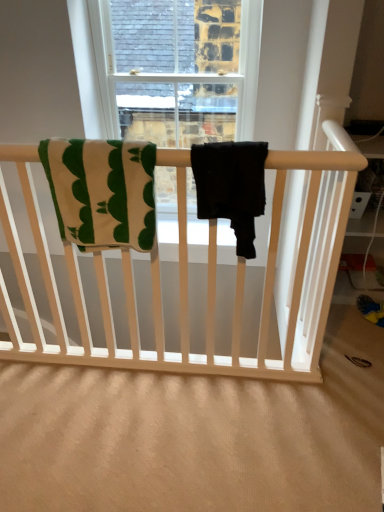
What do you see at coordinates (231, 186) in the screenshot? The width and height of the screenshot is (384, 512). I see `black matte pants at center, the first beach towel from the right` at bounding box center [231, 186].

Where is `black matte pants at center, which is the second beach towel from left to right`? This screenshot has height=512, width=384. black matte pants at center, which is the second beach towel from left to right is located at coordinates (231, 186).

Describe the element at coordinates (102, 191) in the screenshot. I see `green striped towel at upper left, which appears as the 1th beach towel when viewed from the left` at that location.

What is the approximate width of green striped towel at upper left, which appears as the 1th beach towel when viewed from the left?

It is 9.20 inches.

The height and width of the screenshot is (512, 384). I want to click on green striped towel at upper left, which appears as the 1th beach towel when viewed from the left, so click(102, 191).

The height and width of the screenshot is (512, 384). What are the coordinates of `black matte pants at center, the first beach towel from the right` in the screenshot? It's located at (231, 186).

From the picture: Which is more to the right, green striped towel at upper left, which appears as the 1th beach towel when viewed from the left, or black matte pants at center, the first beach towel from the right?

Positioned to the right is black matte pants at center, the first beach towel from the right.

Based on the photo, considering the positions of objects green striped towel at upper left, the second beach towel positioned from the right, and black matte pants at center, which is the second beach towel from left to right, in the image provided, who is behind, green striped towel at upper left, the second beach towel positioned from the right, or black matte pants at center, which is the second beach towel from left to right,?

green striped towel at upper left, the second beach towel positioned from the right, is further from the camera.

Which is in front, point (90, 234) or point (252, 245)?

The point (90, 234) is closer.

From the image's perspective, which is above, green striped towel at upper left, which appears as the 1th beach towel when viewed from the left, or black matte pants at center, which is the second beach towel from left to right?

green striped towel at upper left, which appears as the 1th beach towel when viewed from the left.

From a real-world perspective, is green striped towel at upper left, which appears as the 1th beach towel when viewed from the left, located beneath black matte pants at center, which is the second beach towel from left to right?

Indeed, from a real-world perspective, green striped towel at upper left, which appears as the 1th beach towel when viewed from the left, is positioned beneath black matte pants at center, which is the second beach towel from left to right.

Is green striped towel at upper left, the second beach towel positioned from the right, wider or thinner than black matte pants at center, which is the second beach towel from left to right?

green striped towel at upper left, the second beach towel positioned from the right, is thinner than black matte pants at center, which is the second beach towel from left to right.

Considering the relative sizes of green striped towel at upper left, which appears as the 1th beach towel when viewed from the left, and black matte pants at center, the first beach towel from the right, in the image provided, is green striped towel at upper left, which appears as the 1th beach towel when viewed from the left, shorter than black matte pants at center, the first beach towel from the right,?

In fact, green striped towel at upper left, which appears as the 1th beach towel when viewed from the left, may be taller than black matte pants at center, the first beach towel from the right.

Considering the sizes of green striped towel at upper left, the second beach towel positioned from the right, and black matte pants at center, which is the second beach towel from left to right, in the image, is green striped towel at upper left, the second beach towel positioned from the right, bigger or smaller than black matte pants at center, which is the second beach towel from left to right,?

Considering their sizes, green striped towel at upper left, the second beach towel positioned from the right, takes up more space than black matte pants at center, which is the second beach towel from left to right.

Is green striped towel at upper left, which appears as the 1th beach towel when viewed from the left, located outside black matte pants at center, the first beach towel from the right?

green striped towel at upper left, which appears as the 1th beach towel when viewed from the left, lies outside black matte pants at center, the first beach towel from the right,'s area.

Is green striped towel at upper left, the second beach towel positioned from the right, far away from black matte pants at center, which is the second beach towel from left to right?

No.

Could you tell me if green striped towel at upper left, which appears as the 1th beach towel when viewed from the left, is facing black matte pants at center, which is the second beach towel from left to right?

No, green striped towel at upper left, which appears as the 1th beach towel when viewed from the left, is not facing towards black matte pants at center, which is the second beach towel from left to right.

Locate an element on the screen. Image resolution: width=384 pixels, height=512 pixels. beach towel to the left of black matte pants at center, which is the second beach towel from left to right is located at coordinates (102, 191).

Between black matte pants at center, the first beach towel from the right, and green striped towel at upper left, which appears as the 1th beach towel when viewed from the left, which one appears on the left side from the viewer's perspective?

green striped towel at upper left, which appears as the 1th beach towel when viewed from the left.

Is black matte pants at center, the first beach towel from the right, in front of or behind green striped towel at upper left, the second beach towel positioned from the right, in the image?

In the image, black matte pants at center, the first beach towel from the right, appears in front of green striped towel at upper left, the second beach towel positioned from the right.

Which is in front, point (265, 158) or point (76, 233)?

The point (265, 158) is in front.

From the image's perspective, does black matte pants at center, the first beach towel from the right, appear lower than green striped towel at upper left, which appears as the 1th beach towel when viewed from the left?

Correct, black matte pants at center, the first beach towel from the right, appears lower than green striped towel at upper left, which appears as the 1th beach towel when viewed from the left, in the image.

From a real-world perspective, is black matte pants at center, the first beach towel from the right, physically located above or below green striped towel at upper left, which appears as the 1th beach towel when viewed from the left?

From a real-world perspective, black matte pants at center, the first beach towel from the right, is physically above green striped towel at upper left, which appears as the 1th beach towel when viewed from the left.

Is black matte pants at center, which is the second beach towel from left to right, wider than green striped towel at upper left, which appears as the 1th beach towel when viewed from the left?

Indeed, black matte pants at center, which is the second beach towel from left to right, has a greater width compared to green striped towel at upper left, which appears as the 1th beach towel when viewed from the left.

Which of these two, black matte pants at center, the first beach towel from the right, or green striped towel at upper left, the second beach towel positioned from the right, stands shorter?

Standing shorter between the two is black matte pants at center, the first beach towel from the right.

Can you confirm if black matte pants at center, the first beach towel from the right, is bigger than green striped towel at upper left, which appears as the 1th beach towel when viewed from the left?

No.

Can we say black matte pants at center, which is the second beach towel from left to right, lies outside green striped towel at upper left, which appears as the 1th beach towel when viewed from the left?

Indeed, black matte pants at center, which is the second beach towel from left to right, is completely outside green striped towel at upper left, which appears as the 1th beach towel when viewed from the left.

Is black matte pants at center, the first beach towel from the right, next to green striped towel at upper left, which appears as the 1th beach towel when viewed from the left, and touching it?

Answer: No, black matte pants at center, the first beach towel from the right, is not beside green striped towel at upper left, which appears as the 1th beach towel when viewed from the left.

Is black matte pants at center, the first beach towel from the right, looking in the opposite direction of green striped towel at upper left, the second beach towel positioned from the right?

black matte pants at center, the first beach towel from the right, is not turned away from green striped towel at upper left, the second beach towel positioned from the right.

How many degrees apart are the facing directions of black matte pants at center, which is the second beach towel from left to right, and green striped towel at upper left, which appears as the 1th beach towel when viewed from the left?

The facing directions of black matte pants at center, which is the second beach towel from left to right, and green striped towel at upper left, which appears as the 1th beach towel when viewed from the left, are 0.000166 degrees apart.

In the image, there is a black matte pants at center, the first beach towel from the right. Identify the location of beach towel above it (from the image's perspective). (102, 191).

Image resolution: width=384 pixels, height=512 pixels. In order to click on beach towel located behind the black matte pants at center, the first beach towel from the right in this screenshot , I will do `click(102, 191)`.

The width and height of the screenshot is (384, 512). I want to click on beach towel located on the right of green striped towel at upper left, which appears as the 1th beach towel when viewed from the left, so click(x=231, y=186).